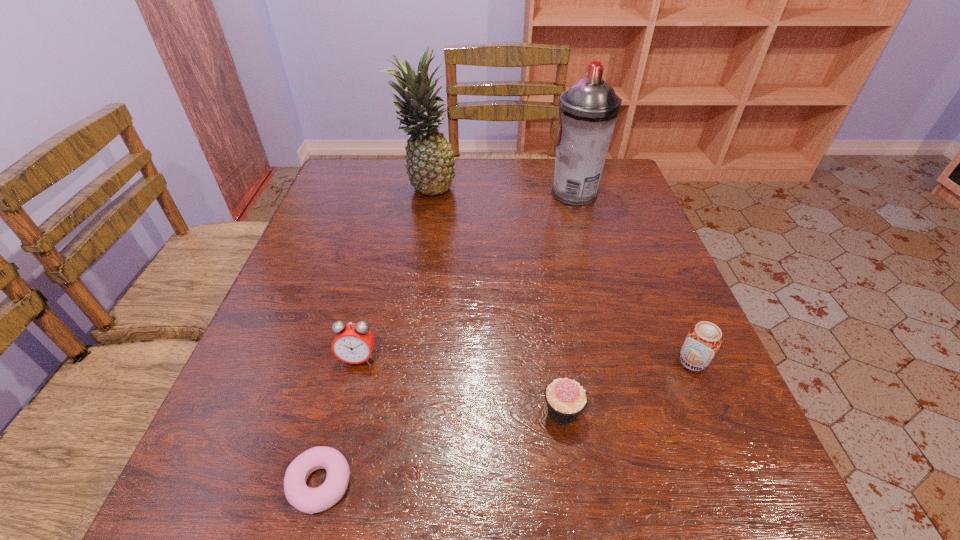
Where is `blank region between the alarm clock and the pineapple`? This screenshot has width=960, height=540. blank region between the alarm clock and the pineapple is located at coordinates (393, 273).

Locate an element on the screen. Image resolution: width=960 pixels, height=540 pixels. empty space that is in between the alarm clock and the cupcake is located at coordinates (461, 385).

Find the location of `free space that is in between the pineapple and the alarm clock`. free space that is in between the pineapple and the alarm clock is located at coordinates (393, 273).

Locate an element on the screen. Image resolution: width=960 pixels, height=540 pixels. free point between the aerosol can and the beer can is located at coordinates click(x=634, y=278).

Locate an element on the screen. The width and height of the screenshot is (960, 540). vacant point located between the pineapple and the cupcake is located at coordinates (494, 299).

What are the coordinates of `vacant area between the fourth object from left to right and the pineapple` in the screenshot? It's located at (494, 299).

The width and height of the screenshot is (960, 540). In order to click on free space between the pineapple and the second object from right to left in this screenshot , I will do `click(501, 191)`.

Locate an element on the screen. This screenshot has height=540, width=960. vacant area that lies between the fifth farthest object and the beer can is located at coordinates 628,387.

Locate an element on the screen. This screenshot has width=960, height=540. object that is the fourth closest to the alarm clock is located at coordinates (x=704, y=339).

Locate which object is the closest to the aerosol can. Please provide its 2D coordinates. Your answer should be formatted as a tuple, i.e. [(x, y)], where the tuple contains the x and y coordinates of a point satisfying the conditions above.

[(429, 157)]